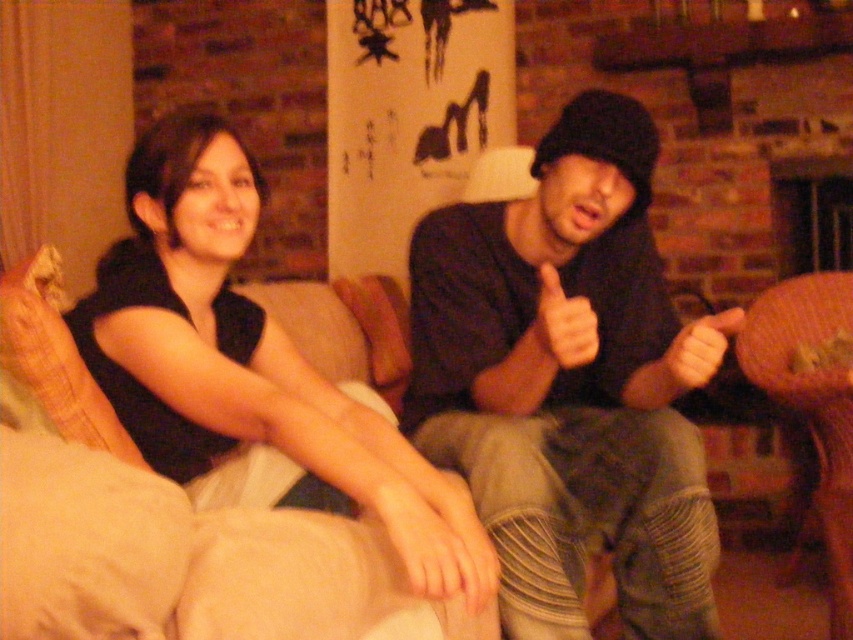
You are a photographer setting up a shoot in this room. You have a black matte hoodie at upper center and a brown woven armchair at lower right. You want to place a spotlight on the object that is to the left of the other. Which object should you choose?

The black matte hoodie at upper center is to the left of the brown woven armchair at lower right, so you should place the spotlight on the black matte hoodie at upper center.

You are a tailor measuring the distance between the dark gray hoodie at center and the matte black hand at center for a custom fitting. The minimum required space for proper adjustment is 20 centimeters. Is the current distance sufficient?

The distance between the dark gray hoodie at center and the matte black hand at center is 23.66 centimeters, which exceeds the minimum requirement of 20 centimeters. Therefore, the current distance is sufficient for the custom fitting.